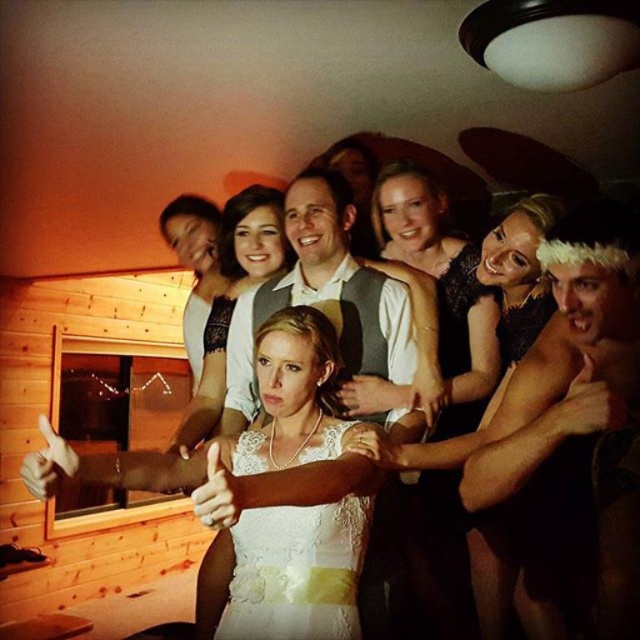
Is point (422, 576) more distant than point (284, 204)?

Yes, point (422, 576) is farther from viewer.

Does satin black dress at center appear under white textured shirt at center?

Yes.

Is point (433, 552) behind point (380, 292)?

Yes.

At what (x,y) coordinates should I click in order to perform the action: click on satin black dress at center. Please return your answer as a coordinate pair (x, y). Image resolution: width=640 pixels, height=640 pixels. Looking at the image, I should click on (442, 289).

Does shiny gold chain at upper center have a greater width compared to white lace dress at center?

Yes.

Does shiny gold chain at upper center lie in front of white lace dress at center?

Yes, it is.

Is point (538, 355) positioned before point (252, 451)?

Yes, point (538, 355) is in front of point (252, 451).

In order to click on shiny gold chain at upper center in this screenshot , I will do `click(573, 428)`.

Is white textured shirt at center closer to the viewer compared to white lace dress at center?

That is False.

Does white textured shirt at center have a greater height compared to white lace dress at center?

Yes, white textured shirt at center is taller than white lace dress at center.

Where is `white textured shirt at center`? This screenshot has height=640, width=640. white textured shirt at center is located at coordinates (323, 298).